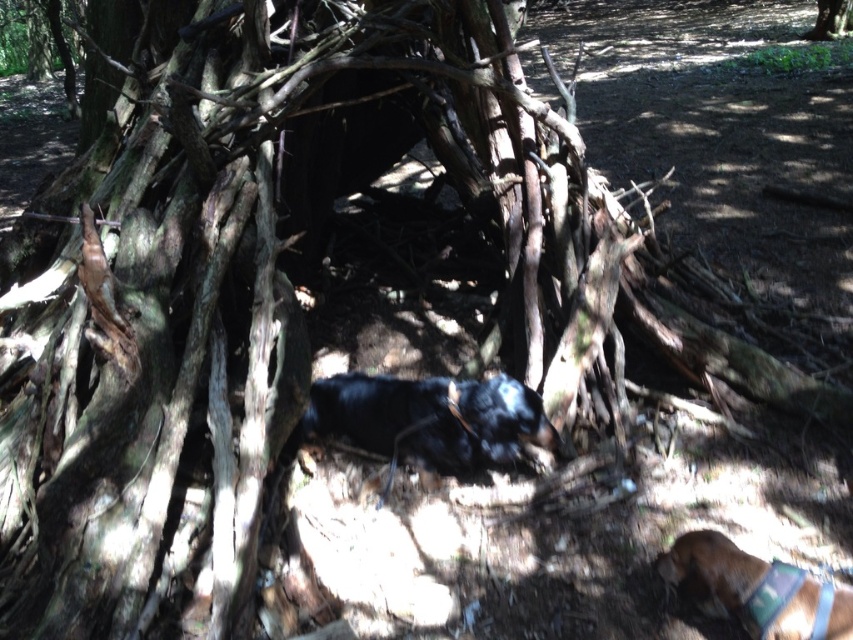
Is black fur dog at center shorter than brown fabric dog at lower right?

Incorrect, black fur dog at center's height does not fall short of brown fabric dog at lower right's.

Locate an element on the screen. The height and width of the screenshot is (640, 853). black fur dog at center is located at coordinates click(x=431, y=419).